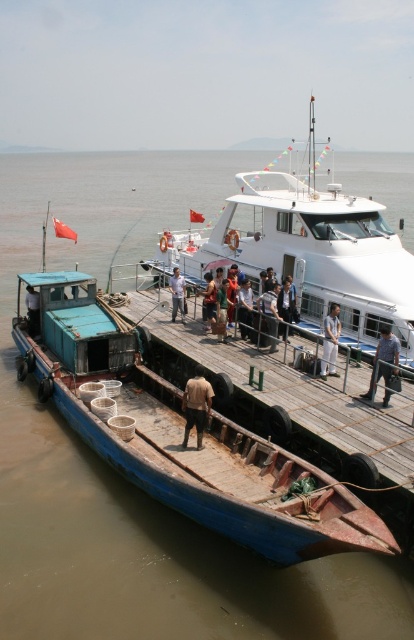
Question: Which point appears closest to the camera in this image?

Choices:
 (A) (315, 397)
 (B) (221, 328)

Answer: (A)

Question: Can you confirm if light brown leather jacket at center is positioned to the right of blue fabric bag at center?

Choices:
 (A) yes
 (B) no

Answer: (A)

Question: Considering the relative positions of light brown leather jacket at center and blue fabric bag at center in the image provided, where is light brown leather jacket at center located with respect to blue fabric bag at center?

Choices:
 (A) below
 (B) above

Answer: (B)

Question: Based on their relative distances, which object is farther from the light brown wooden pole at center?

Choices:
 (A) light brown fabric pants at center
 (B) blue denim jeans at center
 (C) brown fabric shirt at center
 (D) wooden dock at center

Answer: (B)

Question: Which object is the farthest from the brown fabric shirt at center?

Choices:
 (A) dark blue jeans at center
 (B) light brown leather jacket at center
 (C) reddish-brown fabric shirt at center

Answer: (B)

Question: Considering the relative positions of brown fabric shirt at center and light brown wooden pole at center in the image provided, where is brown fabric shirt at center located with respect to light brown wooden pole at center?

Choices:
 (A) left
 (B) right

Answer: (B)